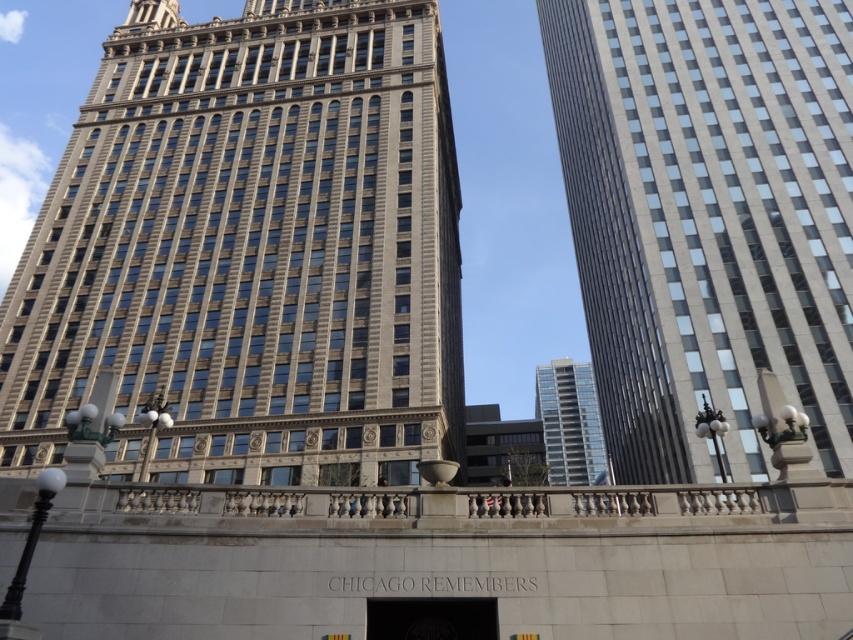
You are a drone operator tasked with flying a drone between the beige stone tower at center and the smooth glass skyscraper at right. The drone has a maximum flight distance of 30 meters. Can the drone safely travel between these two buildings without exceeding its range?

The distance between the beige stone tower at center and the smooth glass skyscraper at right is 29.94 meters, which is just under the drone operator maximum flight distance of 30 meters. The drone can safely travel between them without exceeding its range.

You are standing in the cityscape and want to determine the visibility of two points marked in the image. Which point, point (329, 324) or point (604, 461), is closer to you?

Point (329, 324) is closer to you because it is in front of point (604, 461).

You are standing at the origin point in the cityscape image. There are two points marked in the image, one at coordinates point (381, 49) and the other at point (851, 458). Which point is closer to you?

Point (381, 49) is behind point (851, 458), so the closer point to you is point (851, 458).